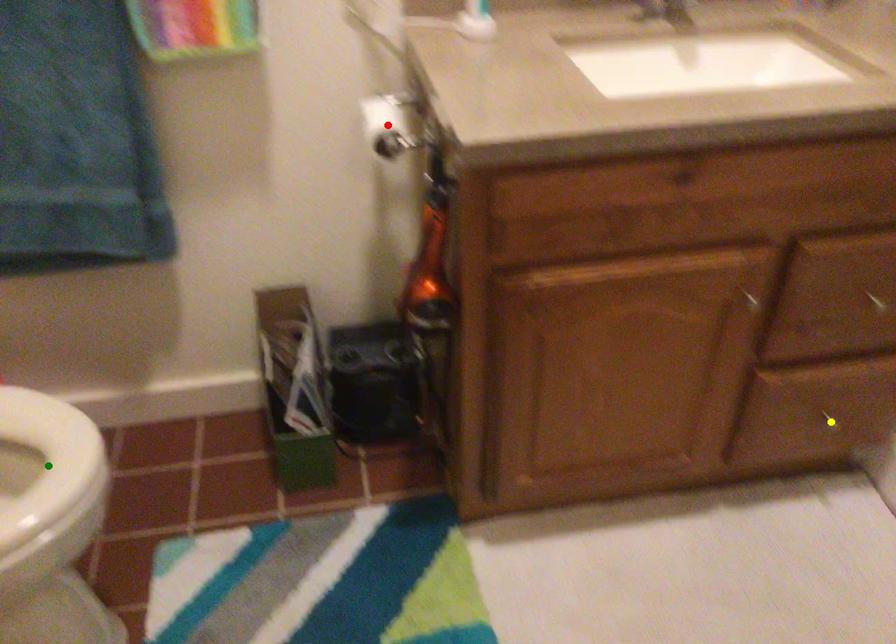
Order these from nearest to farthest:
red point | yellow point | green point

yellow point < red point < green point